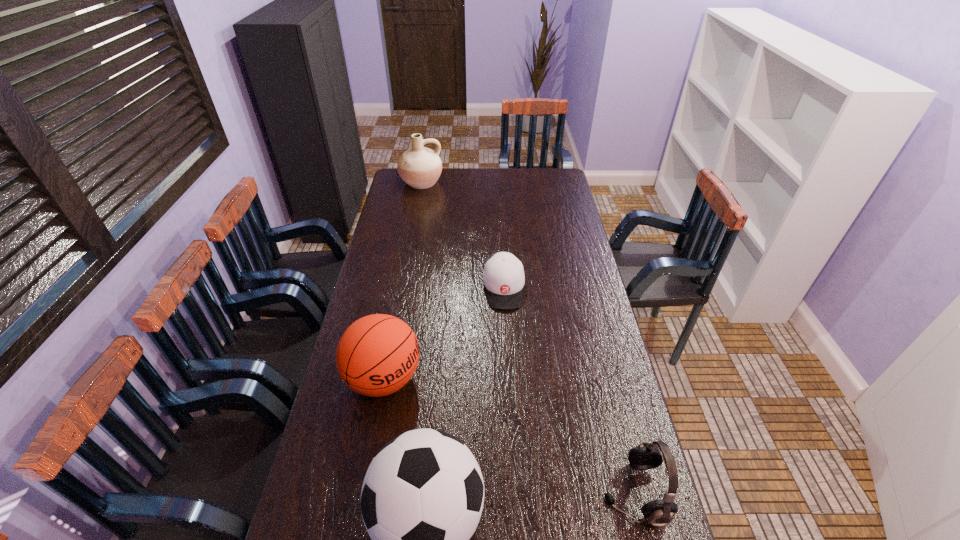
Locate an element on the screen. free space at the near right corner of the desktop is located at coordinates (654, 531).

Locate an element on the screen. The image size is (960, 540). vacant space that is in between the headset and the pottery is located at coordinates (527, 338).

Locate an element on the screen. vacant area that lies between the basketball and the second shortest object is located at coordinates (509, 436).

The image size is (960, 540). I want to click on free space that is in between the rightmost object and the baseball cap, so click(x=568, y=391).

The height and width of the screenshot is (540, 960). I want to click on free space between the third nearest object and the fourth nearest object, so click(444, 334).

Locate an element on the screen. object that can be found as the third closest to the rightmost object is located at coordinates (503, 277).

Locate which object is the second closest to the fourth nearest object. Please provide its 2D coordinates. Your answer should be formatted as a tuple, i.e. [(x, y)], where the tuple contains the x and y coordinates of a point satisfying the conditions above.

[(422, 497)]

Find the location of `vacant space that satisfies the following two spatial constraints: 1. on the front side of the basketball; 2. with the microphone on the side of the headset`. vacant space that satisfies the following two spatial constraints: 1. on the front side of the basketball; 2. with the microphone on the side of the headset is located at coordinates (363, 493).

Where is `free space that satisfies the following two spatial constraints: 1. on the front side of the farthest object; 2. on the left side of the basketball`? free space that satisfies the following two spatial constraints: 1. on the front side of the farthest object; 2. on the left side of the basketball is located at coordinates (383, 379).

Identify the location of free space that satisfies the following two spatial constraints: 1. on the front side of the rightmost object; 2. with the microphone on the side of the farthest object. (361, 493).